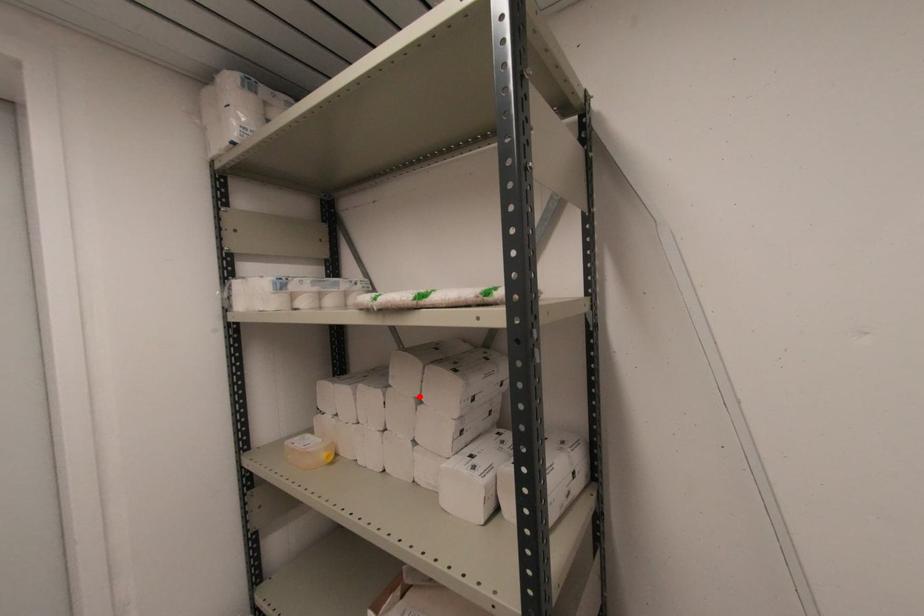
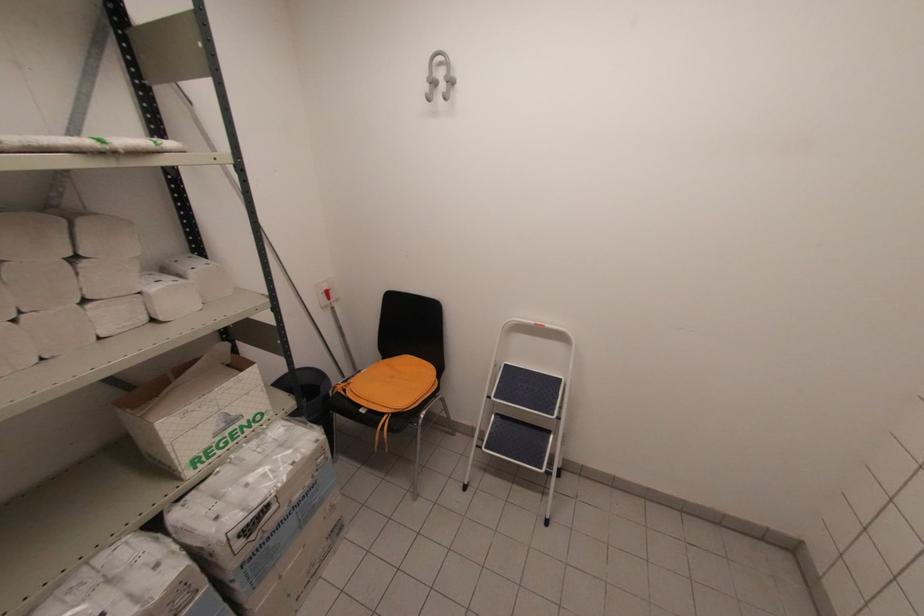
In the second image, find the point that corresponds to the highlighted location in the first image.

(71, 254)